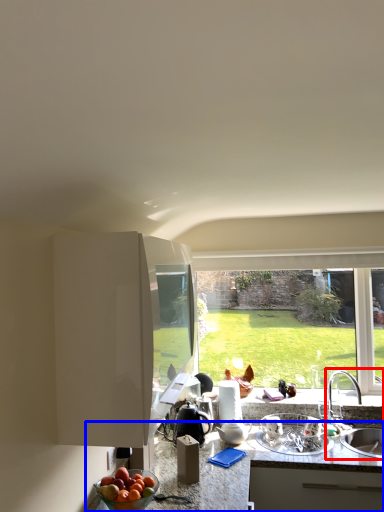
Question: Among these objects, which one is nearest to the camera, sink (highlighted by a red box) or countertop (highlighted by a blue box)?

Choices:
 (A) sink
 (B) countertop

Answer: (B)